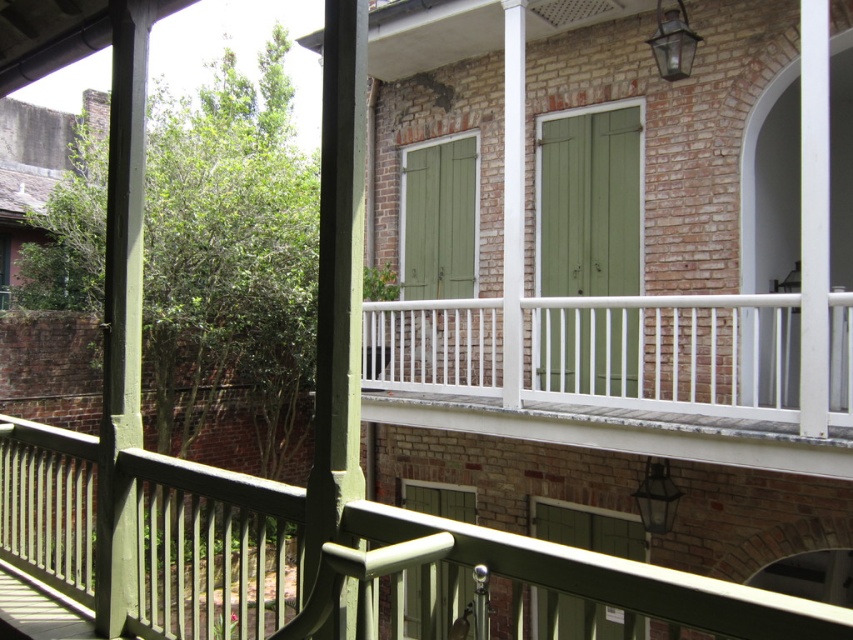
Question: Can you confirm if white painted wood balustrade at center is wider than green matte shutters at center?

Choices:
 (A) no
 (B) yes

Answer: (B)

Question: Can you confirm if green matte shutters at center is thinner than green matte shutter at lower center?

Choices:
 (A) no
 (B) yes

Answer: (A)

Question: Which point is farther from the camera taking this photo?

Choices:
 (A) [x=585, y=445]
 (B) [x=439, y=605]
 (C) [x=540, y=259]
 (D) [x=201, y=476]

Answer: (B)

Question: Does white matte rail at upper center have a lesser width compared to green matte door at center?

Choices:
 (A) no
 (B) yes

Answer: (B)

Question: Which point is farther to the camera?

Choices:
 (A) (432, 593)
 (B) (418, 285)
 (C) (666, 436)

Answer: (B)

Question: Which of the following is the closest to the observer?

Choices:
 (A) (440, 504)
 (B) (616, 600)
 (C) (422, 241)
 (D) (581, 388)

Answer: (B)